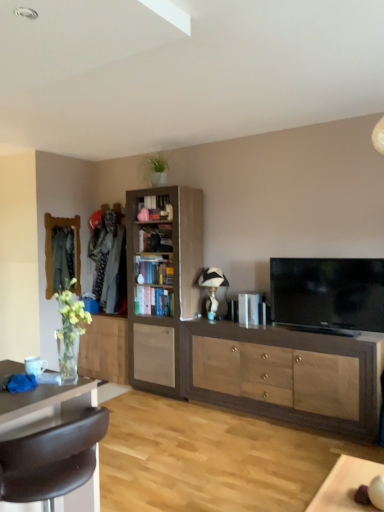
You are a GUI agent. You are given a task and a screenshot of the screen. Output one action in this format:
    pyautogui.click(x=<x>, y=<y>)
    Task: Click on the vacant area situated below flat screen tv at right (from a real-world perspective)
    This screenshot has height=512, width=384.
    Given the screenshot: What is the action you would take?
    pyautogui.click(x=321, y=330)